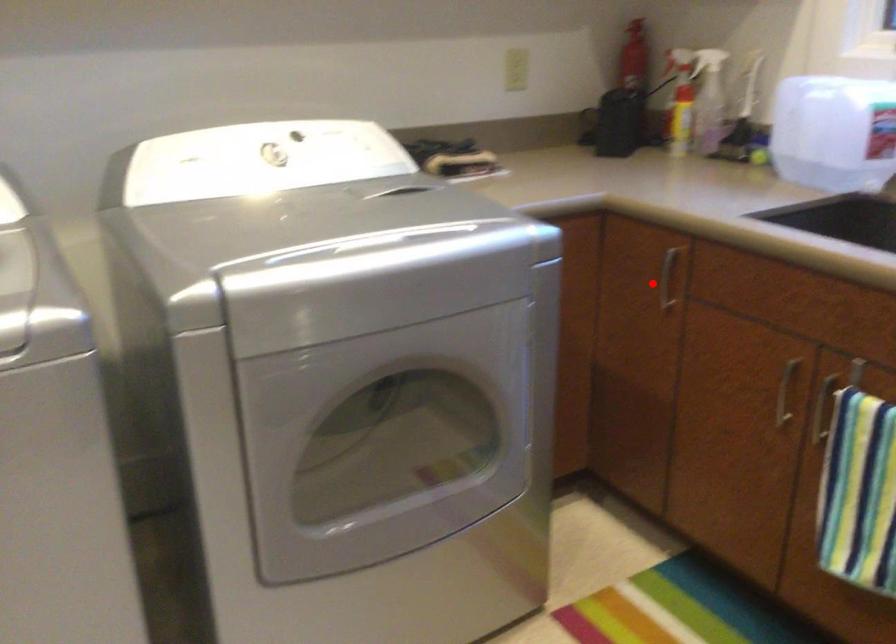
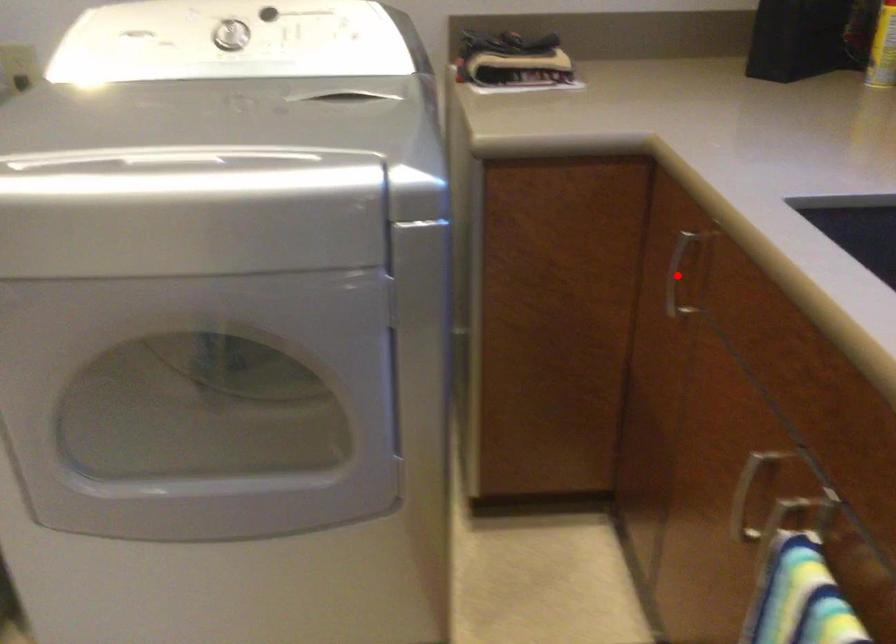
I am providing you with two images of the same scene from different viewpoints. A red point is marked on the first image and another point is marked on the second image. Do the highlighted points in image1 and image2 indicate the same real-world spot?

Yes